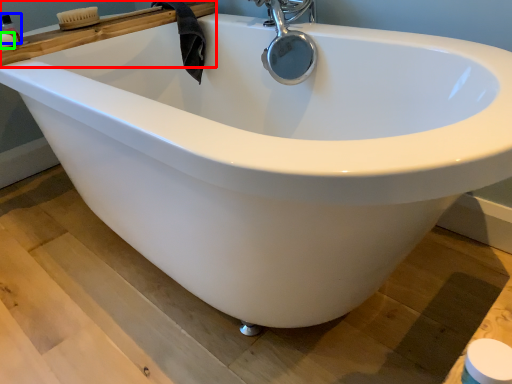
Question: Estimate the real-world distances between objects in this image. Which object is closer to ledge (highlighted by a red box), toiletry (highlighted by a blue box) or soap (highlighted by a green box)?

Choices:
 (A) toiletry
 (B) soap

Answer: (B)